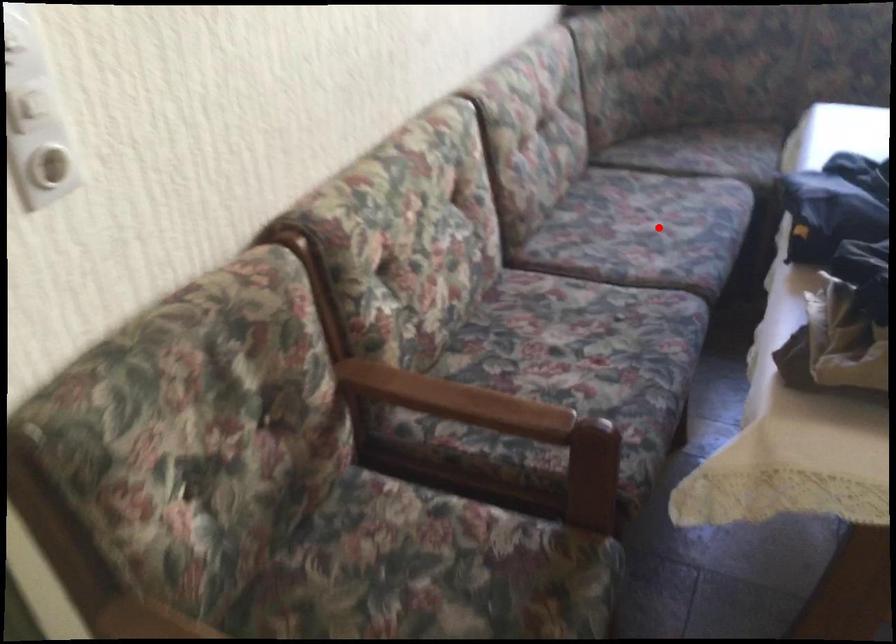
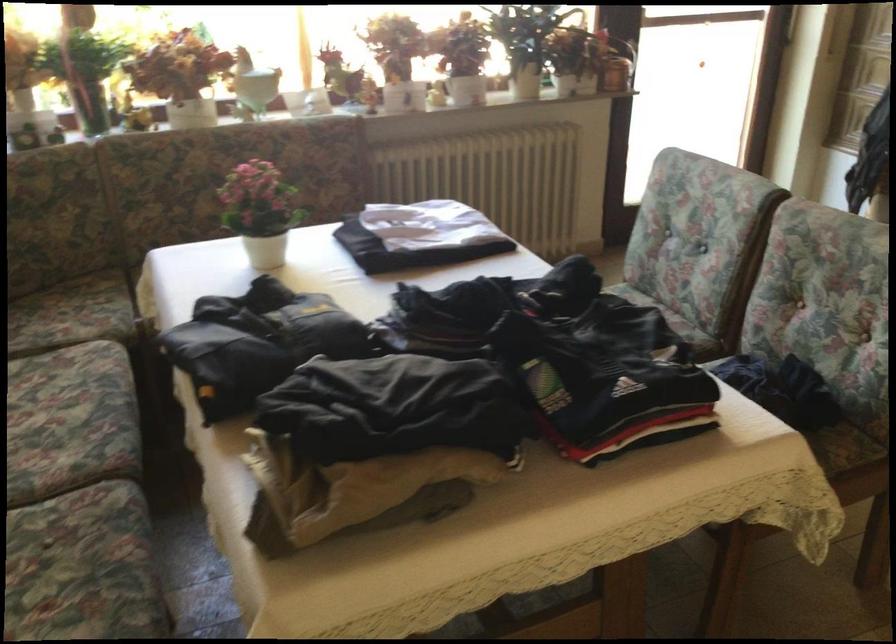
Find the pixel in the second image that matches the highlighted location in the first image.

(69, 413)